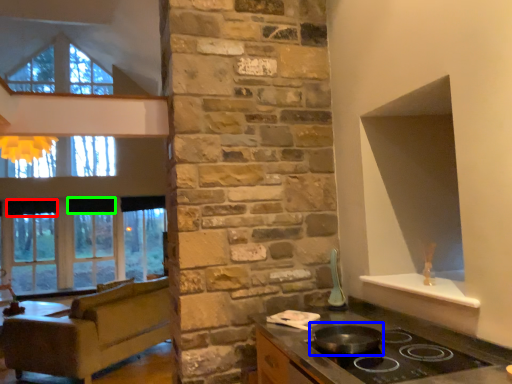
Question: Based on their relative distances, which object is farther from curtain (highlighted by a red box)? Choose from wok (highlighted by a blue box) and curtain (highlighted by a green box).

Choices:
 (A) wok
 (B) curtain

Answer: (A)